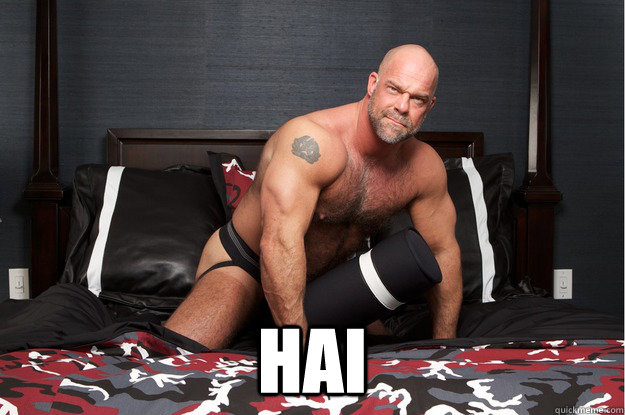
At what (x,y) coordinates should I click in order to perform the action: click on right bedpost. Please return your answer as a coordinate pair (x, y). Looking at the image, I should click on (534, 64).